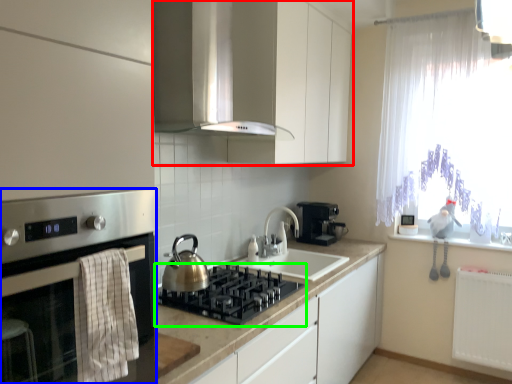
Question: Which object is the farthest from cabinetry (highlighted by a red box)? Choose among these: home appliance (highlighted by a blue box) or gas stove (highlighted by a green box).

Choices:
 (A) home appliance
 (B) gas stove

Answer: (A)